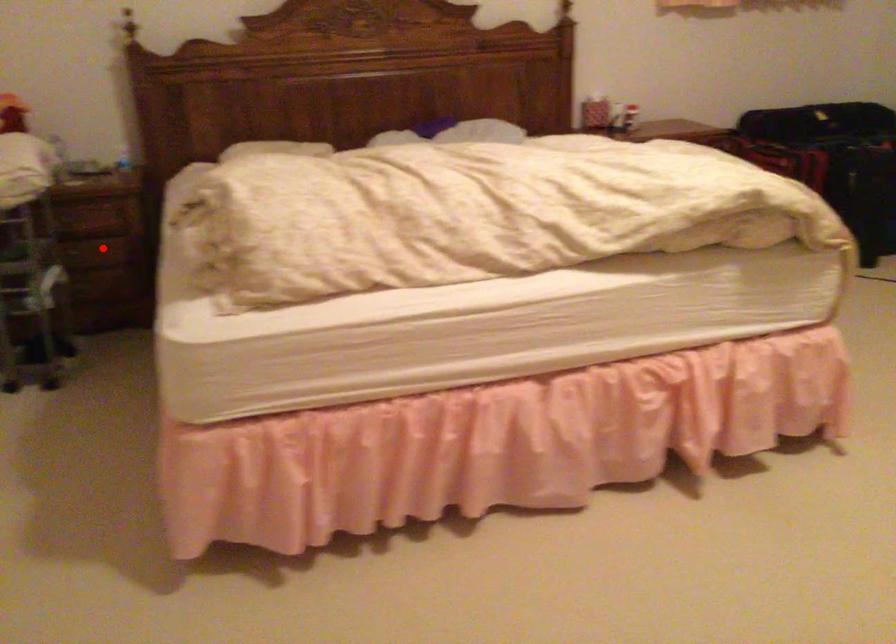
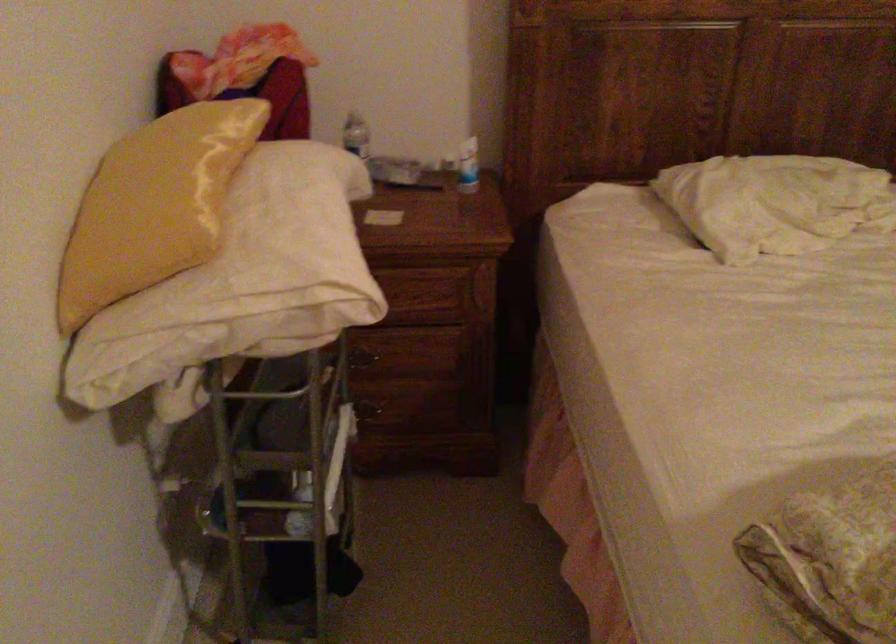
Question: I am providing you with two images of the same scene from different viewpoints. A red point is shown in image1. For the corresponding object point in image2, is it positioned nearer or farther from the camera?

Choices:
 (A) Nearer
 (B) Farther

Answer: (A)